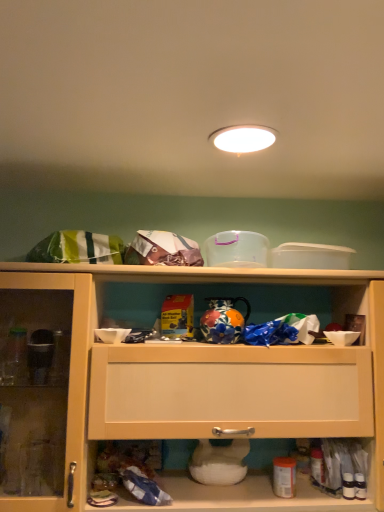
Question: Would you say white glossy light fixture at upper center is inside or outside matte wood cabinet at center?

Choices:
 (A) inside
 (B) outside

Answer: (B)

Question: From a real-world perspective, is white glossy light fixture at upper center positioned above or below matte wood cabinet at center?

Choices:
 (A) below
 (B) above

Answer: (B)

Question: From the image's perspective, is white glossy light fixture at upper center positioned above or below matte wood cabinet at center?

Choices:
 (A) above
 (B) below

Answer: (A)

Question: In the image, is matte wood cabinet at center on the left side or the right side of white glossy light fixture at upper center?

Choices:
 (A) right
 (B) left

Answer: (B)

Question: From a real-world perspective, is matte wood cabinet at center positioned above or below white glossy light fixture at upper center?

Choices:
 (A) above
 (B) below

Answer: (B)

Question: In the image, is matte wood cabinet at center positioned in front of or behind white glossy light fixture at upper center?

Choices:
 (A) front
 (B) behind

Answer: (B)

Question: Considering the positions of matte wood cabinet at center and white glossy light fixture at upper center in the image, is matte wood cabinet at center taller or shorter than white glossy light fixture at upper center?

Choices:
 (A) short
 (B) tall

Answer: (B)